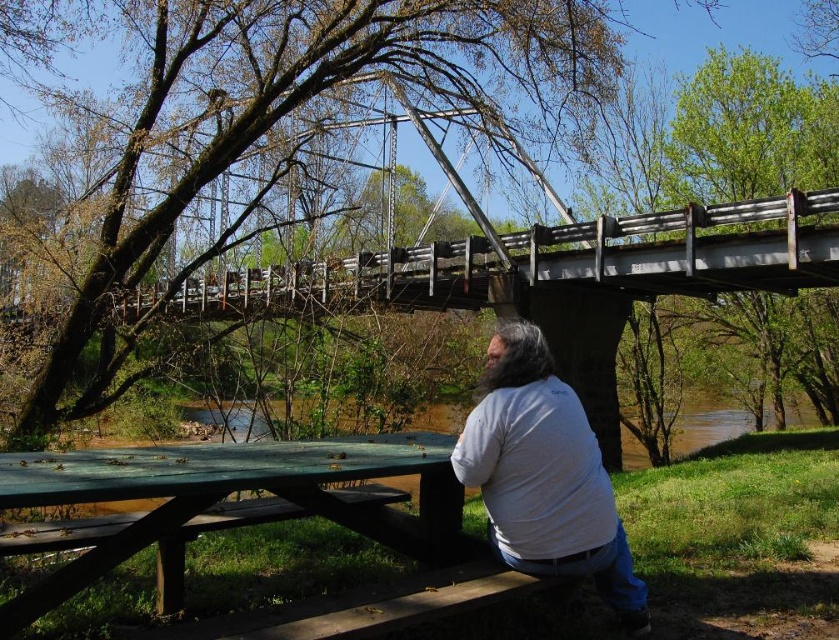
Question: Is green wood picnic table at lower center positioned before wooden bench at lower center?

Choices:
 (A) yes
 (B) no

Answer: (A)

Question: Is green wood picnic table at lower center wider than wooden bench at lower center?

Choices:
 (A) no
 (B) yes

Answer: (B)

Question: Which object is positioned closest to the green wood picnic table at lower center?

Choices:
 (A) white matte shirt at lower center
 (B) wooden bench at lower center

Answer: (B)

Question: Considering the real-world distances, which object is farthest from the wooden bench at lower center?

Choices:
 (A) green wood picnic table at lower center
 (B) white matte shirt at lower center

Answer: (A)

Question: Observing the image, what is the correct spatial positioning of green wood picnic table at lower center in reference to white matte shirt at lower center?

Choices:
 (A) left
 (B) right

Answer: (A)

Question: Which is nearer to the wooden bench at lower center?

Choices:
 (A) white matte shirt at lower center
 (B) green wood picnic table at lower center

Answer: (A)